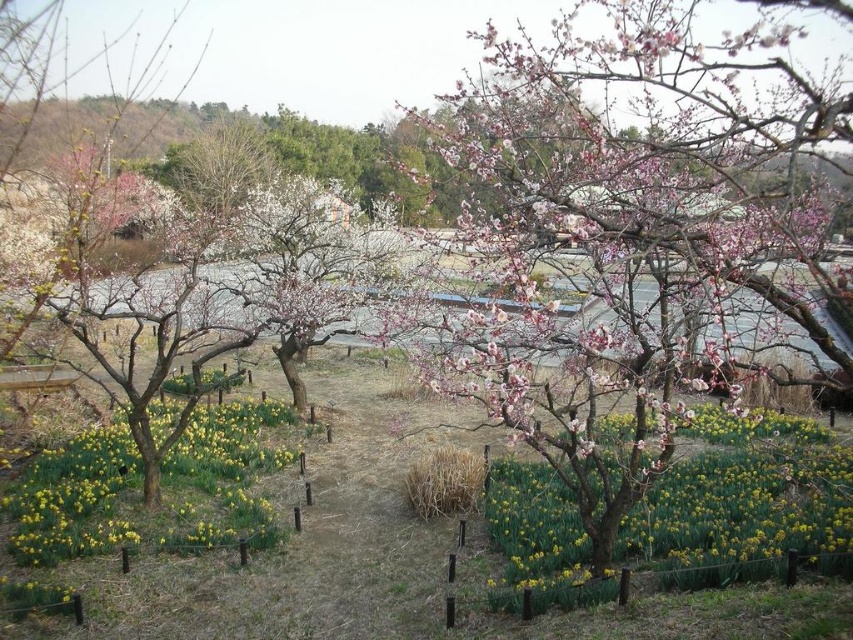
Question: Which object is farther from the camera taking this photo?

Choices:
 (A) pink bloom tree at center
 (B) yellow matte daffodil at center

Answer: (B)

Question: Is pink bloom tree at center to the right of pink matte flower at center from the viewer's perspective?

Choices:
 (A) no
 (B) yes

Answer: (A)

Question: Which of these objects is positioned closest to the yellow matte daffodil at center?

Choices:
 (A) pink matte flower at center
 (B) pink bloom tree at center

Answer: (B)

Question: Does pink matte flower at center appear on the left side of yellow matte daffodil at center?

Choices:
 (A) no
 (B) yes

Answer: (A)

Question: Does pink bloom tree at center lie behind pink matte flower at center?

Choices:
 (A) no
 (B) yes

Answer: (A)

Question: Among these points, which one is nearest to the camera?

Choices:
 (A) (802, 225)
 (B) (732, 436)

Answer: (A)